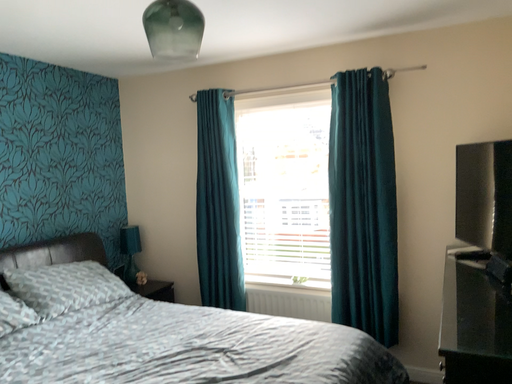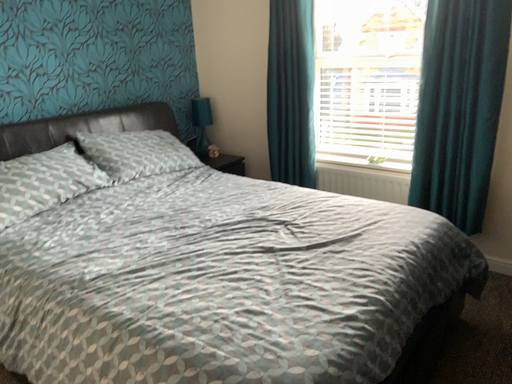
Question: Which way did the camera rotate in the video?

Choices:
 (A) rotated left
 (B) rotated right

Answer: (A)